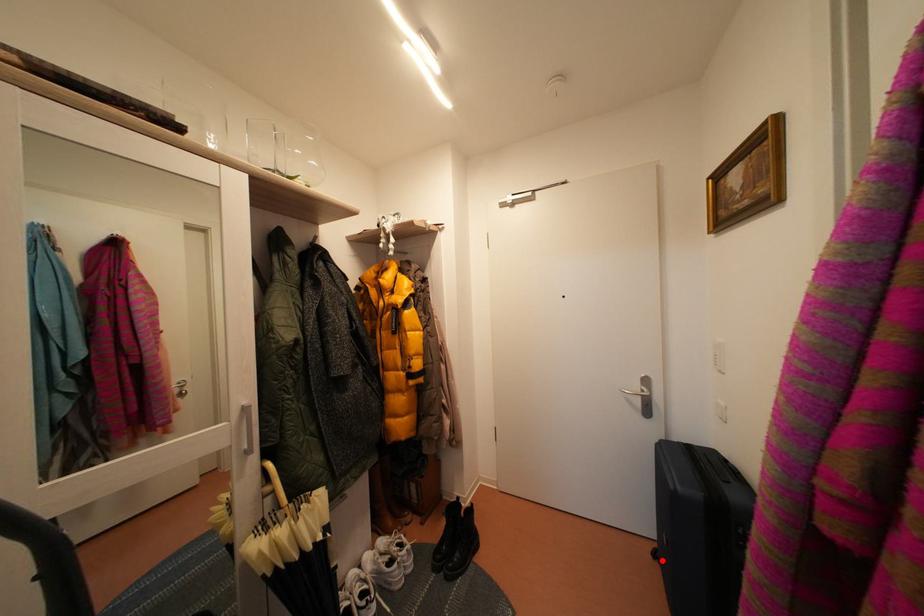
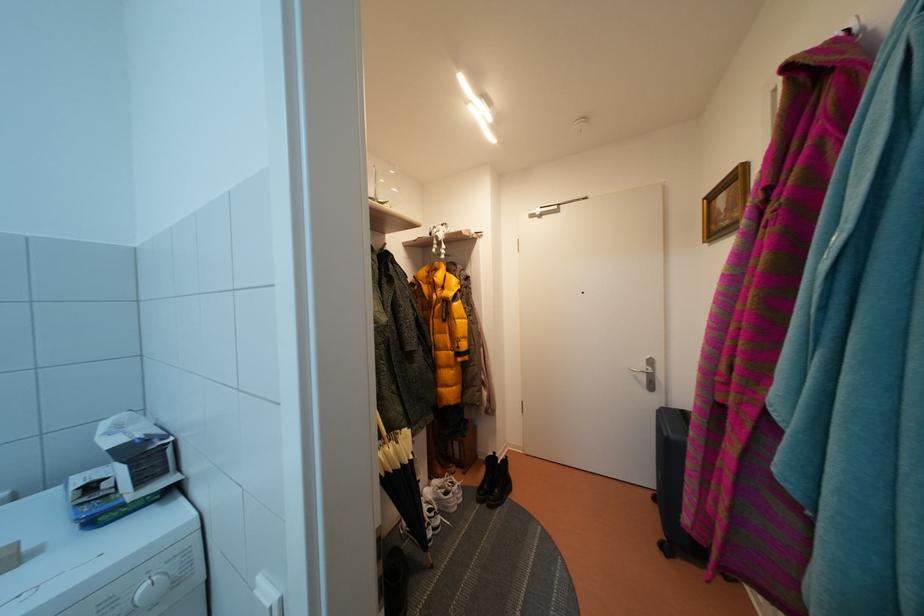
Find the pixel in the second image that matches the highlighted location in the first image.

(662, 505)